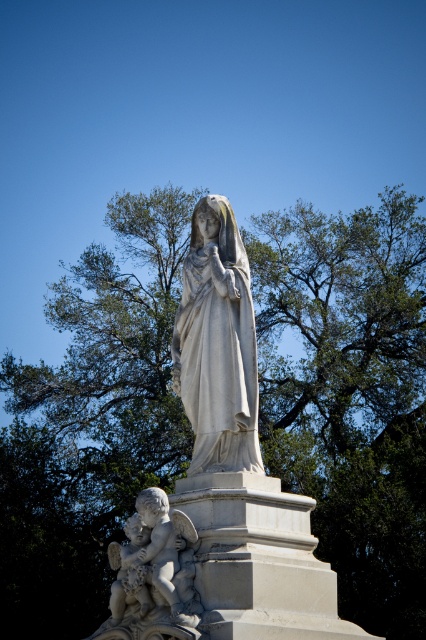
You are standing in the outdoor area and want to take a photo of the white marble statue at center. If your camera has a maximum zoom range of 50 meters, will you be able to capture the statue clearly without moving closer?

The white marble statue at center is 67.50 meters away from the viewer. Since the camera can only zoom up to 50 meters, you won not be able to capture the statue clearly without moving closer.

You are an artist planning to paint this scene. You want to ensure the white marble statue at center is visible against the green leafy tree at upper center. Given their sizes, what adjustment should you make to the composition?

The green leafy tree at upper center is bigger than the white marble statue at center. To ensure visibility, you should reduce the size of the green leafy tree at upper center or increase the size of the white marble statue at center in your painting.